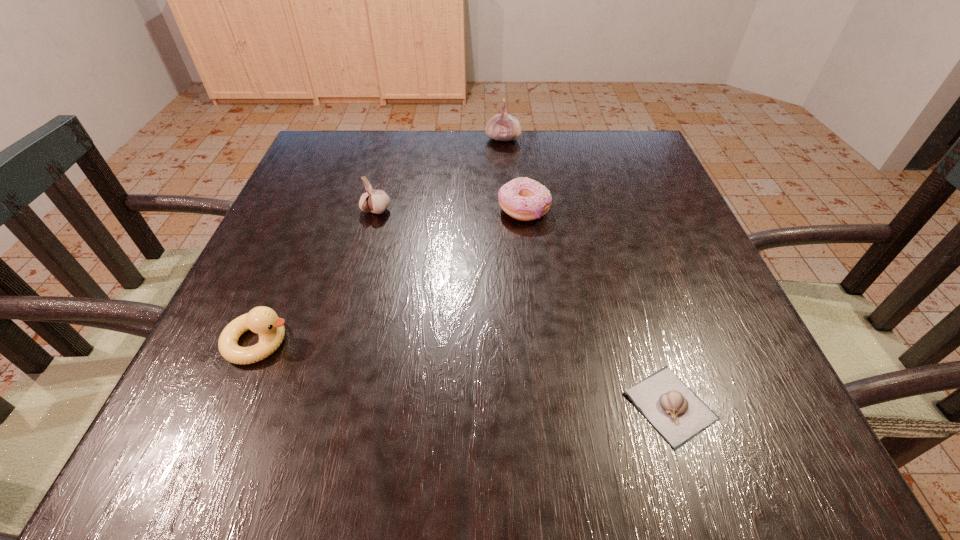
The image size is (960, 540). In the image, there is a desktop. Find the location of `vacant space at the right edge`. vacant space at the right edge is located at coordinates (632, 225).

Image resolution: width=960 pixels, height=540 pixels. Identify the location of vacant space at the far left corner of the desktop. click(351, 148).

In order to click on free region at the far right corner of the desktop in this screenshot , I will do `click(601, 137)`.

Image resolution: width=960 pixels, height=540 pixels. I want to click on free spot between the nearest garlic and the duckling, so click(x=465, y=374).

What are the coordinates of `free space that is in between the leftmost object and the fourth tallest object` in the screenshot? It's located at (392, 275).

The width and height of the screenshot is (960, 540). I want to click on vacant space that's between the leftmost object and the tallest object, so click(381, 240).

You are a GUI agent. You are given a task and a screenshot of the screen. Output one action in this format:
    pyautogui.click(x=<x>, y=<y>)
    Task: Click on the empty space between the fourth object from right to left and the shortest object
    Image resolution: width=960 pixels, height=540 pixels.
    Given the screenshot: What is the action you would take?
    pyautogui.click(x=523, y=308)

At what (x,y) coordinates should I click in order to perform the action: click on free area in between the doughnut and the second nearest garlic. Please return your answer as a coordinate pair (x, y). The width and height of the screenshot is (960, 540). Looking at the image, I should click on (450, 210).

Where is `vacant point located between the tallest object and the leftmost object`? The height and width of the screenshot is (540, 960). vacant point located between the tallest object and the leftmost object is located at coordinates (381, 240).

Where is `free area in between the leftmost object and the farthest garlic`? The image size is (960, 540). free area in between the leftmost object and the farthest garlic is located at coordinates pyautogui.click(x=381, y=240).